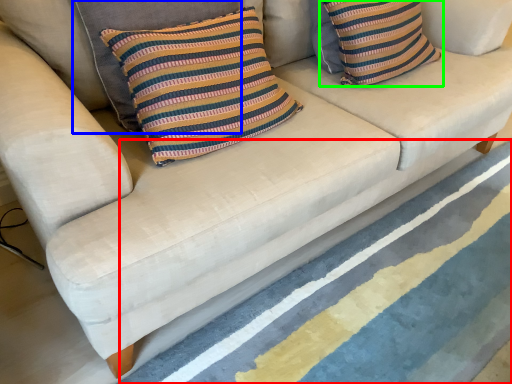
Question: Based on their relative distances, which object is nearer to stripe (highlighted by a red box)? Choose from pillow (highlighted by a blue box) and pillow (highlighted by a green box).

Choices:
 (A) pillow
 (B) pillow

Answer: (B)